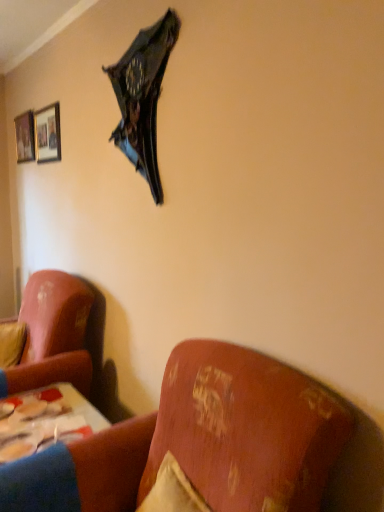
Question: Is velvet-like pink couch at lower left inside or outside of velvet yellow pillow at left?

Choices:
 (A) inside
 (B) outside

Answer: (B)

Question: In the image, is velvet-like pink couch at lower left positioned in front of or behind velvet yellow pillow at left?

Choices:
 (A) front
 (B) behind

Answer: (A)

Question: Which of these objects is positioned farthest from the matte black picture frame at upper left, the second picture frame from the left?

Choices:
 (A) velvet-like pink couch at lower left
 (B) shiny metallic umbrella at upper center
 (C) velvet yellow pillow at left
 (D) wooden framed picture at upper left, the second picture frame when ordered from right to left
 (E) wooden table at lower left

Answer: (A)

Question: Considering the real-world distances, which object is closest to the matte black picture frame at upper left, the second picture frame from the left?

Choices:
 (A) velvet-like pink couch at lower left
 (B) velvet yellow pillow at left
 (C) shiny metallic umbrella at upper center
 (D) wooden table at lower left
 (E) wooden framed picture at upper left, arranged as the 1th picture frame when viewed from the back

Answer: (E)